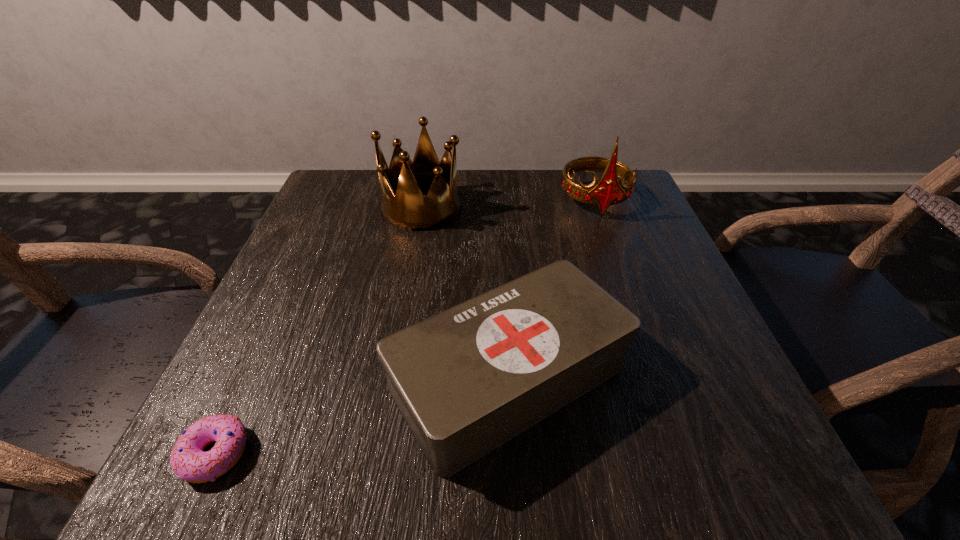
I want to click on tiara, so click(x=607, y=191).

In order to click on crown in this screenshot , I will do `click(401, 204)`.

Find the location of a particular element. This screenshot has width=960, height=540. the first-aid kit is located at coordinates (466, 380).

Find the location of `the leftmost object`. the leftmost object is located at coordinates (188, 461).

Locate an element on the screen. doughnut is located at coordinates (188, 461).

Locate an element on the screen. The height and width of the screenshot is (540, 960). free space located on the front-facing side of the tiara is located at coordinates (618, 265).

In order to click on vacant space located 0.110m on the left of the crown in this screenshot , I will do `click(334, 207)`.

Identify the location of vacant space located 0.080m on the left of the first-aid kit. Image resolution: width=960 pixels, height=540 pixels. (338, 378).

Find the location of a particular element. This screenshot has height=540, width=960. free space located 0.170m on the right of the leftmost object is located at coordinates (374, 453).

I want to click on tiara that is at the far edge, so click(x=607, y=191).